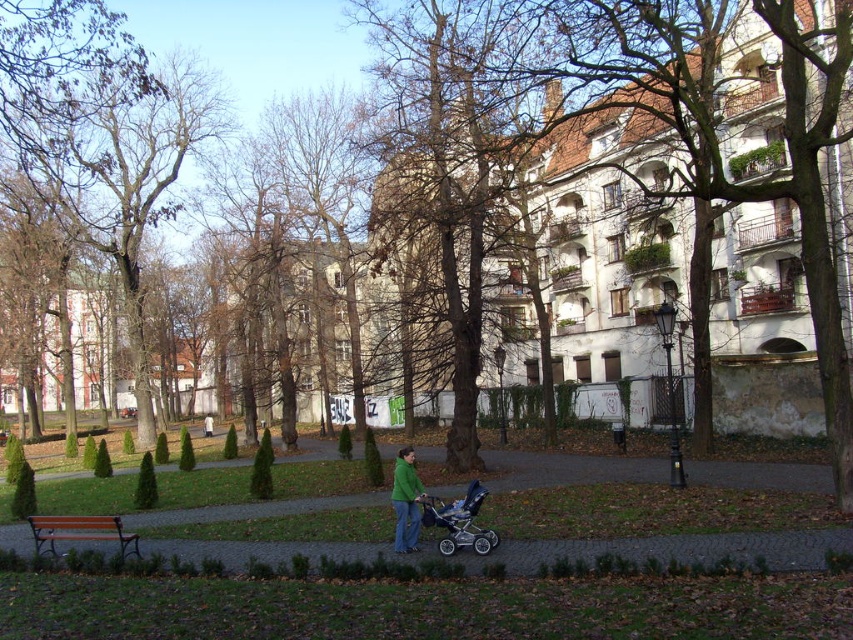
You are standing at the point where the woman is pushing the stroller. Looking towards the direction of the paved pathway, can you see the brown leafless tree at upper left represented by point (131,180)?

Yes, the brown leafless tree at upper left represented by point (131,180) is visible from the woman pushing the stroller along the paved pathway.

You are standing at the entrance of the park and see the brown leafless tree at upper left and the brown paved path at lower center. Which object is positioned to the left of the other?

The brown leafless tree at upper left is positioned to the left of the brown paved path at lower center.

You are standing at the point labeled as point (463,166) in the image. What object is located at this point?

The point (463,166) corresponds to the brown rough bark tree at center.